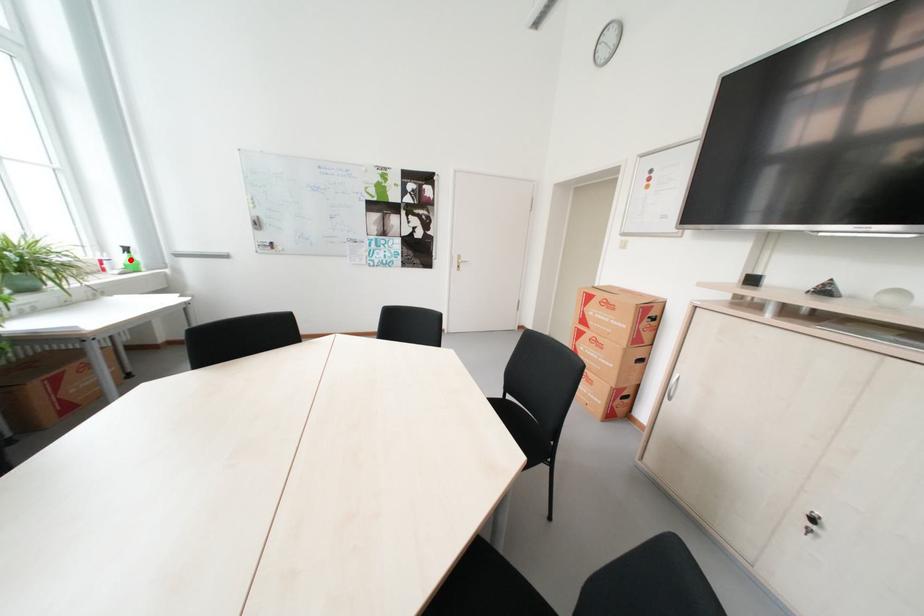
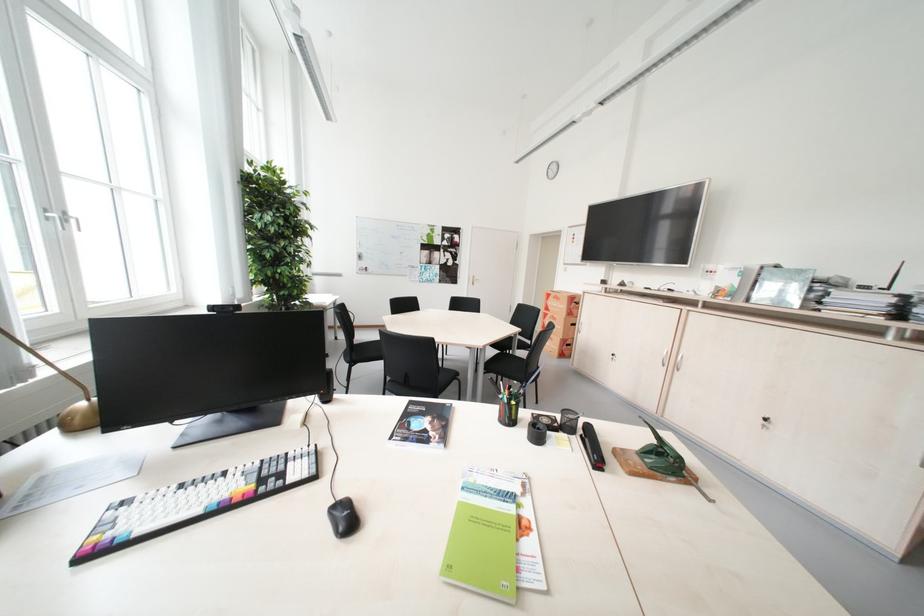
Question: I am providing you with two images of the same scene from different viewpoints. A red point is marked on the first image. At the location where the point appears in image 1, is it still visible in image 2?

Choices:
 (A) Yes
 (B) No

Answer: (B)